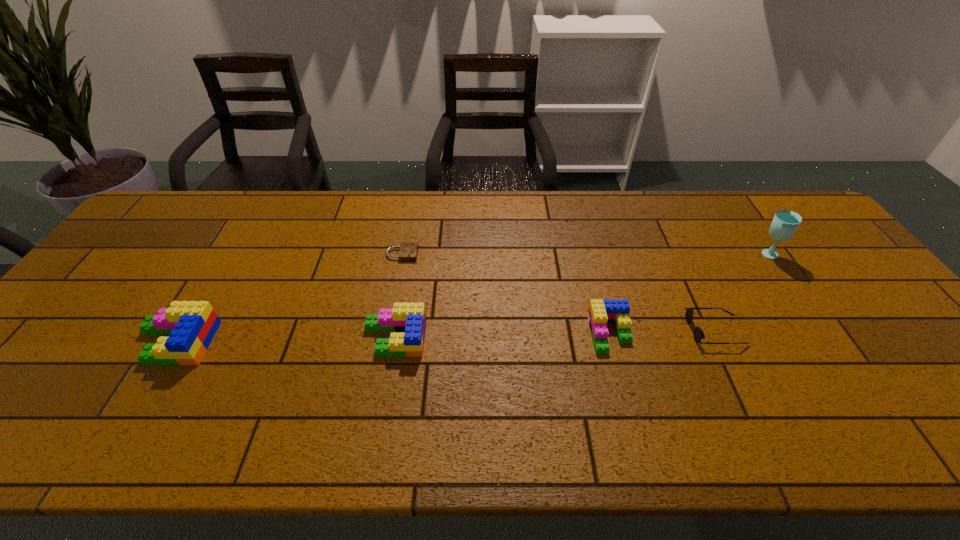
Identify the location of vacant area that lies between the leftmost object and the fifth object from left to right. (445, 336).

Find the location of `object that is the fourth nearest to the shortest object`. object that is the fourth nearest to the shortest object is located at coordinates (698, 334).

This screenshot has width=960, height=540. Find the location of `object that ranks as the fourth closest to the rightmost Lego`. object that ranks as the fourth closest to the rightmost Lego is located at coordinates (408, 251).

Where is `Lego that is the second closest to the shortest Lego`? Image resolution: width=960 pixels, height=540 pixels. Lego that is the second closest to the shortest Lego is located at coordinates (191, 325).

Image resolution: width=960 pixels, height=540 pixels. Find the location of `Lego that is the second nearest to the shortest Lego`. Lego that is the second nearest to the shortest Lego is located at coordinates (191, 325).